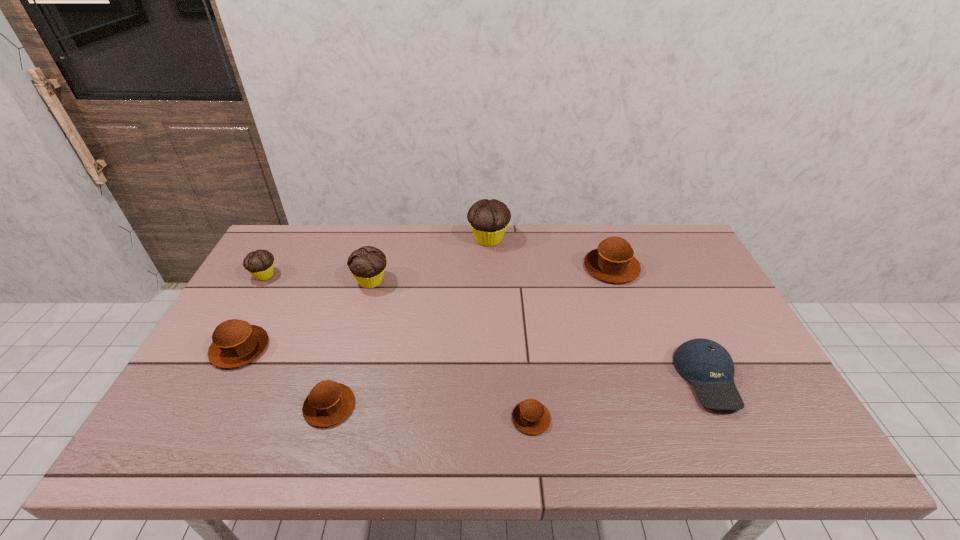
The image size is (960, 540). I want to click on muffin that can be found as the closest to the third brown muffin from left to right, so click(x=328, y=403).

Locate which muffin ranks in proximity to the blue baseball cap. Please provide its 2D coordinates. Your answer should be formatted as a tuple, i.e. [(x, y)], where the tuple contains the x and y coordinates of a point satisfying the conditions above.

[(613, 261)]

Select which chocolate muffin is the closest to the leftmost chocolate muffin. Please provide its 2D coordinates. Your answer should be formatted as a tuple, i.e. [(x, y)], where the tuple contains the x and y coordinates of a point satisfying the conditions above.

[(367, 264)]

Choose which chocolate muffin is the nearest neighbor to the tallest object. Please provide its 2D coordinates. Your answer should be formatted as a tuple, i.e. [(x, y)], where the tuple contains the x and y coordinates of a point satisfying the conditions above.

[(367, 264)]

In order to click on brown muffin that is the second closest to the leftmost brown muffin in this screenshot , I will do `click(530, 416)`.

Choose which brown muffin is the second nearest neighbor to the third biggest brown muffin. Please provide its 2D coordinates. Your answer should be formatted as a tuple, i.e. [(x, y)], where the tuple contains the x and y coordinates of a point satisfying the conditions above.

[(530, 416)]

Where is `vacant region that satisfies the following two spatial constraints: 1. on the back side of the tallest object; 2. on the left side of the leftmost brown muffin`? The height and width of the screenshot is (540, 960). vacant region that satisfies the following two spatial constraints: 1. on the back side of the tallest object; 2. on the left side of the leftmost brown muffin is located at coordinates (297, 239).

At what (x,y) coordinates should I click in order to perform the action: click on vacant space that satisfies the following two spatial constraints: 1. on the back side of the tallest object; 2. on the left side of the leftmost chocolate muffin. Please return your answer as a coordinate pair (x, y). Image resolution: width=960 pixels, height=540 pixels. Looking at the image, I should click on (285, 239).